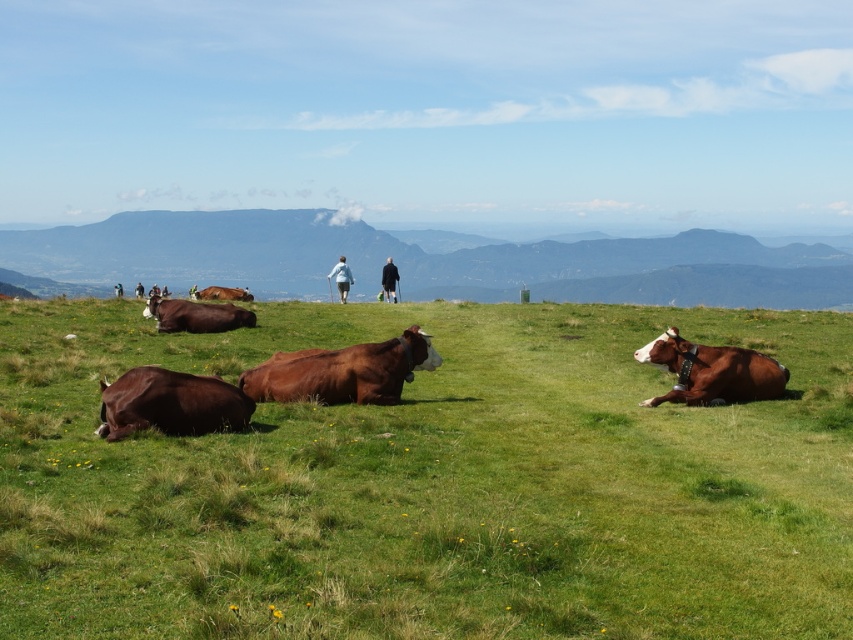
Question: Which point is farther from the camera taking this photo?

Choices:
 (A) (337, 406)
 (B) (729, 392)
 (C) (207, 330)

Answer: (C)

Question: From the image, what is the correct spatial relationship of green grass at center in relation to brown leather cow at right?

Choices:
 (A) left
 (B) right

Answer: (A)

Question: Where is brown smooth cow at lower left located in relation to brown leather cow at right in the image?

Choices:
 (A) right
 (B) left

Answer: (B)

Question: Does shiny brown cow at center appear under light blue fabric jacket at center?

Choices:
 (A) no
 (B) yes

Answer: (B)

Question: Which object is the closest to the brown matte cow at center?

Choices:
 (A) shiny brown cow at center
 (B) dark brown leather jacket at center
 (C) brown leather cow at right
 (D) brown smooth cow at center

Answer: (B)

Question: Which point is closer to the camera taking this photo?

Choices:
 (A) (99, 323)
 (B) (175, 316)

Answer: (B)